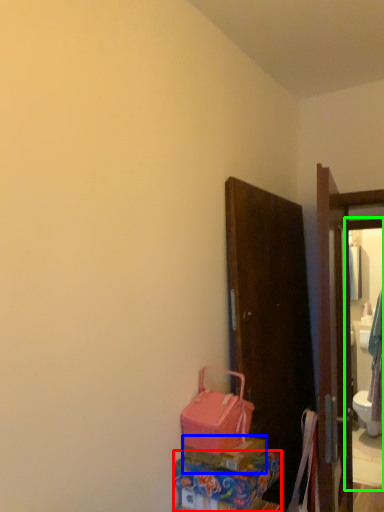
Question: Which object is the closest to the box (highlighted by a red box)? Choose among these: box (highlighted by a blue box) or mirror (highlighted by a green box).

Choices:
 (A) box
 (B) mirror

Answer: (A)